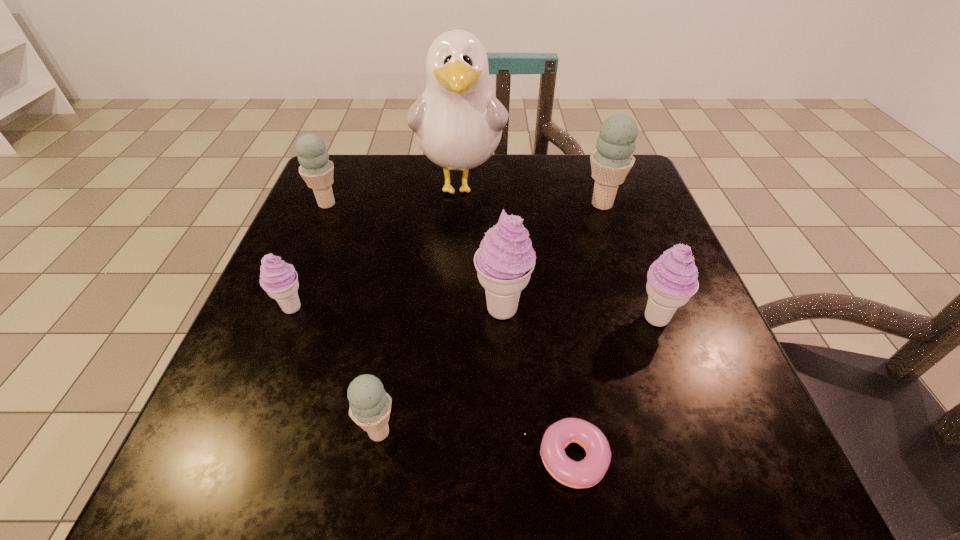
The height and width of the screenshot is (540, 960). What are the coordinates of `gull located at the far edge` in the screenshot? It's located at (458, 122).

Locate an element on the screen. ice cream located in the near edge section of the desktop is located at coordinates (370, 405).

Identify the location of doughnut that is at the near edge. The image size is (960, 540). (586, 473).

Where is `object that is at the far left corner`? This screenshot has height=540, width=960. object that is at the far left corner is located at coordinates (316, 169).

Locate an element on the screen. object located in the far right corner section of the desktop is located at coordinates (612, 160).

The image size is (960, 540). I want to click on vacant space at the far edge, so click(486, 176).

Locate an element on the screen. The image size is (960, 540). vacant region at the near edge of the desktop is located at coordinates [x=444, y=454].

In the image, there is a desktop. Where is `vacant space at the right edge`? The width and height of the screenshot is (960, 540). vacant space at the right edge is located at coordinates (730, 376).

In the image, there is a desktop. Where is `free region at the far left corner`? This screenshot has height=540, width=960. free region at the far left corner is located at coordinates (354, 194).

The width and height of the screenshot is (960, 540). I want to click on free space between the doughnut and the biggest purple icecream, so click(535, 383).